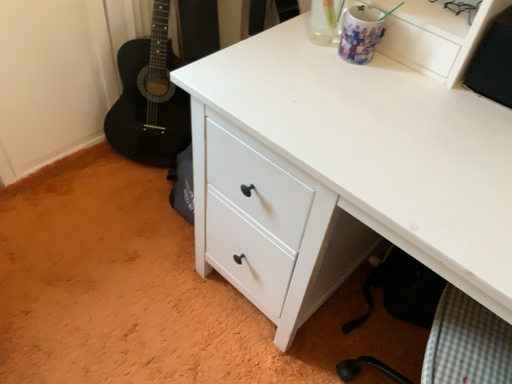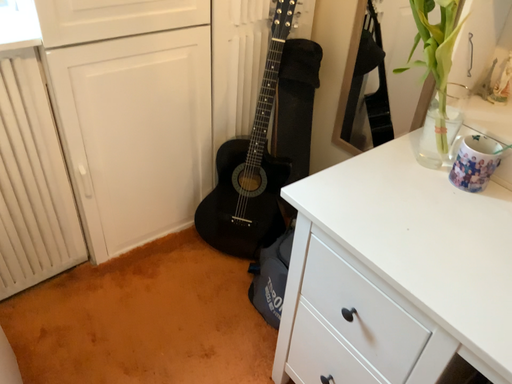
Question: Which way did the camera rotate in the video?

Choices:
 (A) rotated upward
 (B) rotated downward

Answer: (A)